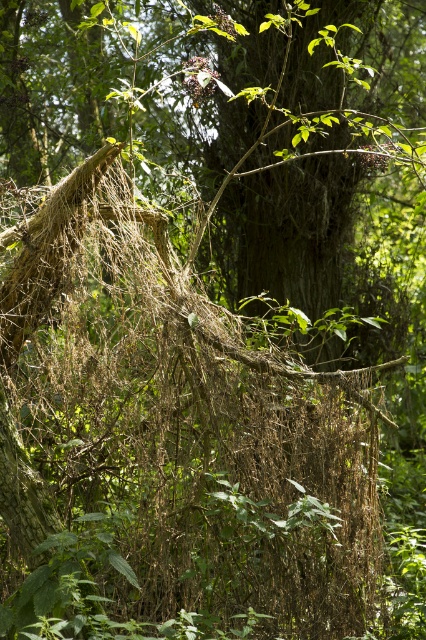
You are standing in the forest and want to reach a point that is 4.02 meters away from you. According to the scene description, can you identify the point labeled as point (x=169, y=376) that is exactly at that distance?

Yes, the point labeled as point (x=169, y=376) is exactly 4.02 meters away from the viewer, so it matches the desired distance.

You are a hiker trying to navigate through the forest. You see the brown dried grass at center and the brown rough bark tree trunk at center. Which object is positioned to the left side from your perspective?

The brown dried grass at center is to the left of the brown rough bark tree trunk at center, so it is positioned to the left side from your perspective.

You are a hiker trying to navigate through the forest. You see the brown dried grass at center and the brown rough bark tree trunk at center. Which object would you need to step over or around due to its size?

The brown dried grass at center is larger in size than the brown rough bark tree trunk at center, so you would need to step over or around the brown dried grass at center.